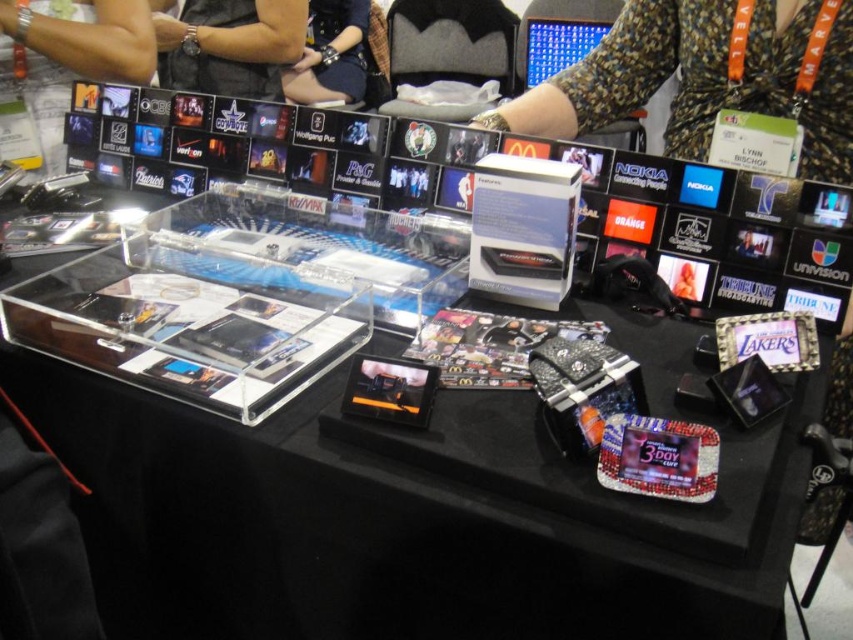
Which is above, floral-patterned blouse at upper center or matte black watch at upper center?

matte black watch at upper center

In the scene shown: Can you confirm if floral-patterned blouse at upper center is bigger than matte black watch at upper center?

Yes, floral-patterned blouse at upper center is bigger than matte black watch at upper center.

Who is more distant from viewer, (602, 84) or (196, 19)?

The point (196, 19) is behind.

The image size is (853, 640). I want to click on floral-patterned blouse at upper center, so pyautogui.click(x=672, y=72).

Is transparent acrylic tray at center to the right of floral-patterned blouse at upper center from the viewer's perspective?

Incorrect, transparent acrylic tray at center is not on the right side of floral-patterned blouse at upper center.

Does transparent acrylic tray at center appear under floral-patterned blouse at upper center?

Indeed, transparent acrylic tray at center is positioned under floral-patterned blouse at upper center.

At what (x,y) coordinates should I click in order to perform the action: click on transparent acrylic tray at center. Please return your answer as a coordinate pair (x, y). The image size is (853, 640). Looking at the image, I should click on (387, 493).

Which is more to the left, matte black watch at upper center or matte black arm at upper left?

From the viewer's perspective, matte black arm at upper left appears more on the left side.

Does point (178, 19) lie behind point (80, 54)?

That is True.

Locate an element on the screen. The width and height of the screenshot is (853, 640). matte black watch at upper center is located at coordinates (230, 45).